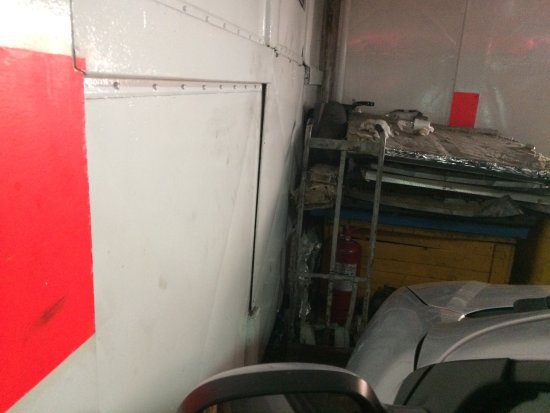
At what (x,y) coordinates should I click in order to perform the action: click on seam in wall. Please return your answer as a coordinate pair (x, y). Looking at the image, I should click on (263, 96).